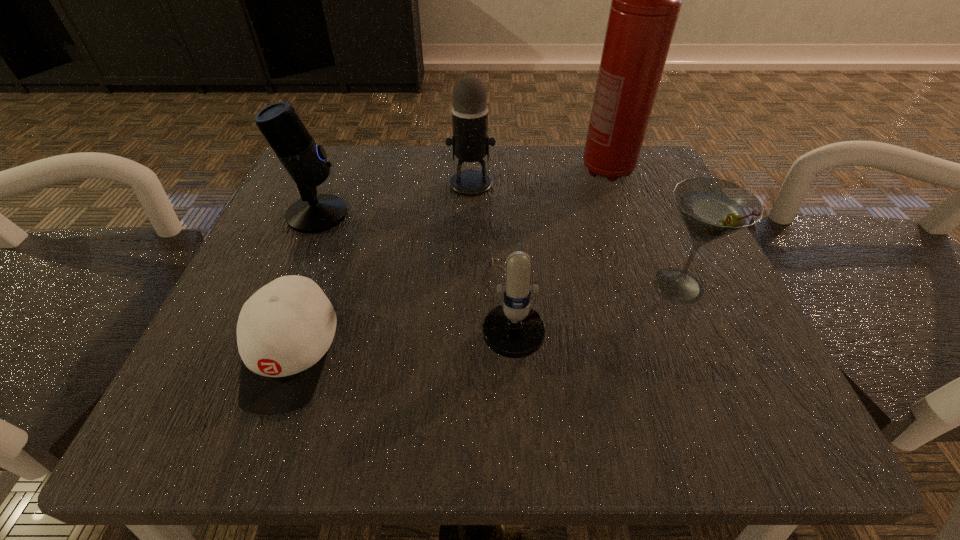
Where is `object that is positioned at the near left corner`? This screenshot has height=540, width=960. object that is positioned at the near left corner is located at coordinates (284, 331).

Locate an element on the screen. object situated at the far right corner is located at coordinates (646, 0).

Image resolution: width=960 pixels, height=540 pixels. I want to click on vacant space at the far edge of the desktop, so click(x=554, y=188).

In the image, there is a desktop. Identify the location of vacant space at the near edge. This screenshot has height=540, width=960. (554, 440).

Where is `blank space at the left edge`? The image size is (960, 540). blank space at the left edge is located at coordinates (238, 351).

Where is `free location at the right edge`? Image resolution: width=960 pixels, height=540 pixels. free location at the right edge is located at coordinates point(644,231).

Where is `vacant space in between the tallest object and the shortest microphone`? The height and width of the screenshot is (540, 960). vacant space in between the tallest object and the shortest microphone is located at coordinates (559, 239).

Where is `free space between the nearest microphone and the fourth nearest object`? The width and height of the screenshot is (960, 540). free space between the nearest microphone and the fourth nearest object is located at coordinates (414, 261).

Where is `free space between the farthest microphone and the shortest object`? Image resolution: width=960 pixels, height=540 pixels. free space between the farthest microphone and the shortest object is located at coordinates (381, 269).

I want to click on empty space between the martini and the nearest microphone, so click(x=594, y=296).